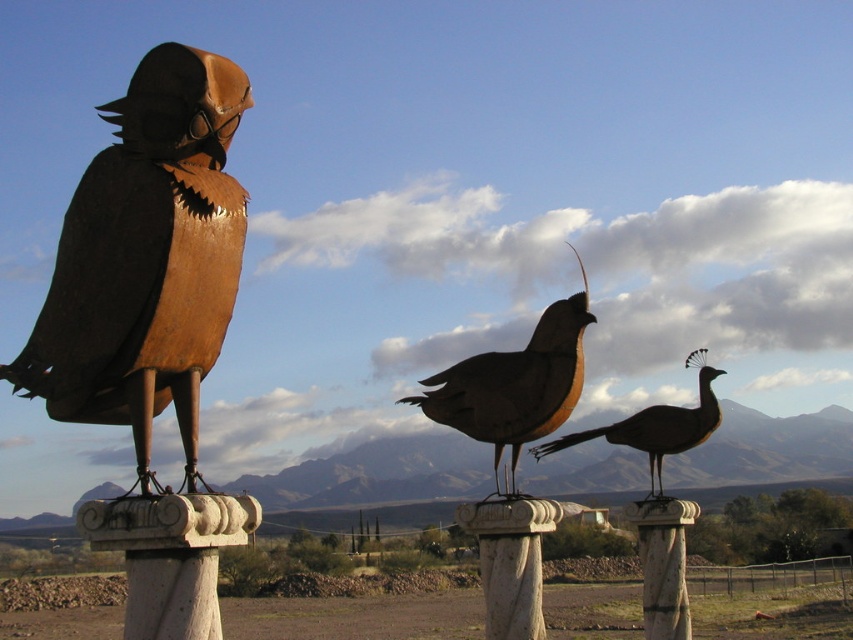
You are standing in front of three bird sculptures. The first is a dark, textured raven on the left, the second is a brownish orange quail in the middle, and the third is a metallic bird on the right. You notice a specific point at coordinates (146,259). Which bird sculpture does this point correspond to?

The point at (146,259) corresponds to the rusty metal bird at left.